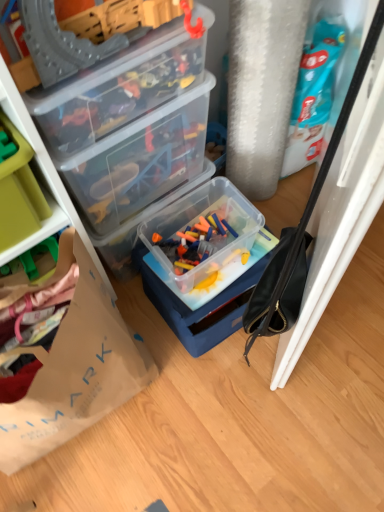
Question: Considering the positions of translucent plastic container at center, the 3th box in the top-to-bottom sequence, and brown paper bag at lower left in the image, is translucent plastic container at center, the 3th box in the top-to-bottom sequence, taller or shorter than brown paper bag at lower left?

Choices:
 (A) tall
 (B) short

Answer: (B)

Question: In the image, is translucent plastic container at center, the 3th box in the top-to-bottom sequence, positioned in front of or behind brown paper bag at lower left?

Choices:
 (A) front
 (B) behind

Answer: (B)

Question: Estimate the real-world distances between objects in this image. Which object is closer to the brown paper bag at lower left?

Choices:
 (A) transparent plastic toy box at upper center, the third box in the bottom-to-top sequence
 (B) translucent plastic container at center, the 3th box in the top-to-bottom sequence
 (C) transparent plastic container at upper left, the second box positioned from the top
 (D) green plastic storage box at left

Answer: (D)

Question: Based on their relative distances, which object is nearer to the green plastic storage box at left?

Choices:
 (A) transparent plastic toy box at upper center, the third box in the bottom-to-top sequence
 (B) transparent plastic container at upper left, positioned as the 2th box in bottom-to-top order
 (C) brown paper bag at lower left
 (D) translucent plastic container at center, which is the 1th box in bottom-to-top order

Answer: (A)